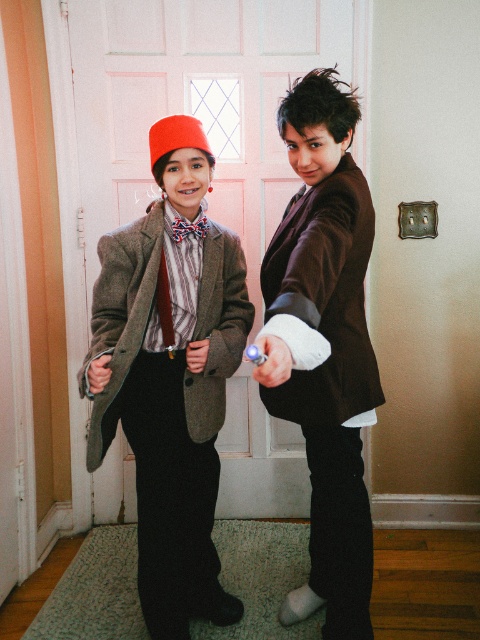
Question: Which object is the closest to the matte brown coat at center?

Choices:
 (A) matte brown blazer at center
 (B) matte wool tie at center
 (C) red satin tie at center

Answer: (A)

Question: Is matte brown blazer at center to the left of red satin tie at center from the viewer's perspective?

Choices:
 (A) no
 (B) yes

Answer: (A)

Question: Is matte brown coat at center wider than matte brown blazer at center?

Choices:
 (A) no
 (B) yes

Answer: (B)

Question: Can you confirm if red satin tie at center is wider than matte wool tie at center?

Choices:
 (A) no
 (B) yes

Answer: (B)

Question: Which point appears farthest from the camera in this image?

Choices:
 (A) (297, 195)
 (B) (191, 227)
 (C) (331, 554)
 (D) (288, 108)

Answer: (A)

Question: Which of these objects is positioned farthest from the matte brown blazer at center?

Choices:
 (A) matte wool tie at center
 (B) red satin tie at center

Answer: (B)